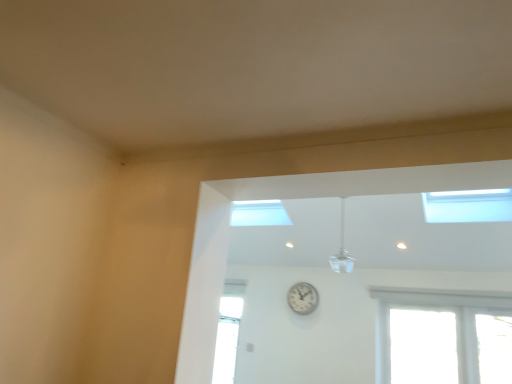
Question: Is white metallic clock at center facing away from white glossy ceiling fan at upper center?

Choices:
 (A) yes
 (B) no

Answer: (B)

Question: Is white metallic clock at center wider than white glossy ceiling fan at upper center?

Choices:
 (A) no
 (B) yes

Answer: (A)

Question: Is white glossy ceiling fan at upper center surrounded by white metallic clock at center?

Choices:
 (A) no
 (B) yes

Answer: (A)

Question: Is white metallic clock at center positioned far away from white glossy ceiling fan at upper center?

Choices:
 (A) no
 (B) yes

Answer: (A)

Question: Does white metallic clock at center appear on the right side of white glossy ceiling fan at upper center?

Choices:
 (A) yes
 (B) no

Answer: (B)

Question: In terms of width, does transparent glass window at upper right look wider or thinner when compared to white glossy ceiling fan at upper center?

Choices:
 (A) thin
 (B) wide

Answer: (B)

Question: Which is correct: transparent glass window at upper right is inside white glossy ceiling fan at upper center, or outside of it?

Choices:
 (A) inside
 (B) outside

Answer: (B)

Question: Is transparent glass window at upper right bigger or smaller than white glossy ceiling fan at upper center?

Choices:
 (A) big
 (B) small

Answer: (A)

Question: From the image's perspective, is transparent glass window at upper right positioned above or below white glossy ceiling fan at upper center?

Choices:
 (A) below
 (B) above

Answer: (B)

Question: Does point (474, 208) appear closer or farther from the camera than point (303, 288)?

Choices:
 (A) closer
 (B) farther

Answer: (A)

Question: From a real-world perspective, relative to white metallic clock at center, is transparent glass window at upper right vertically above or below?

Choices:
 (A) above
 (B) below

Answer: (A)

Question: Considering the positions of transparent glass window at upper right and white metallic clock at center in the image, is transparent glass window at upper right wider or thinner than white metallic clock at center?

Choices:
 (A) thin
 (B) wide

Answer: (B)

Question: From the image's perspective, is transparent glass window at upper right located above or below white metallic clock at center?

Choices:
 (A) above
 (B) below

Answer: (A)

Question: Is point tap(305, 297) closer or farther from the camera than point tap(453, 198)?

Choices:
 (A) farther
 (B) closer

Answer: (A)

Question: In terms of height, does white metallic clock at center look taller or shorter compared to transparent glass window at upper right?

Choices:
 (A) short
 (B) tall

Answer: (B)